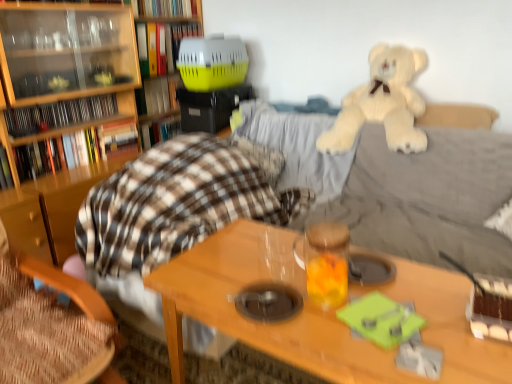
The width and height of the screenshot is (512, 384). I want to click on vacant area in front of translucent glass jar at center, so click(330, 332).